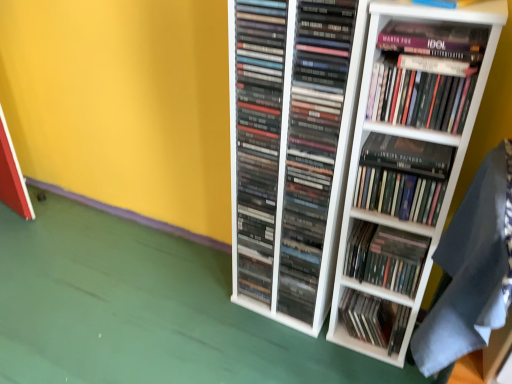
Where is `free space to the left of white matte bookshelf at center`? The image size is (512, 384). free space to the left of white matte bookshelf at center is located at coordinates (298, 352).